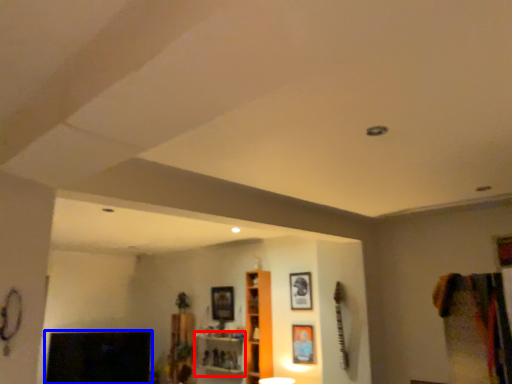
Question: Which point is further to the camera, shelf (highlighted by a red box) or fireplace (highlighted by a blue box)?

Choices:
 (A) shelf
 (B) fireplace

Answer: (B)